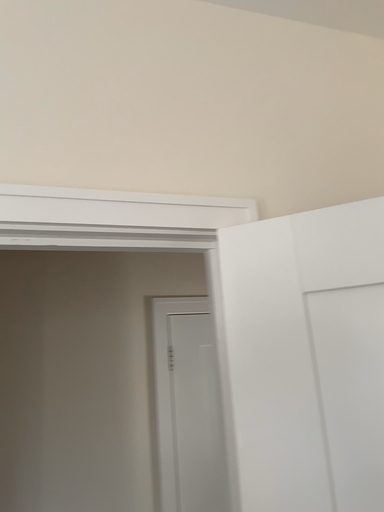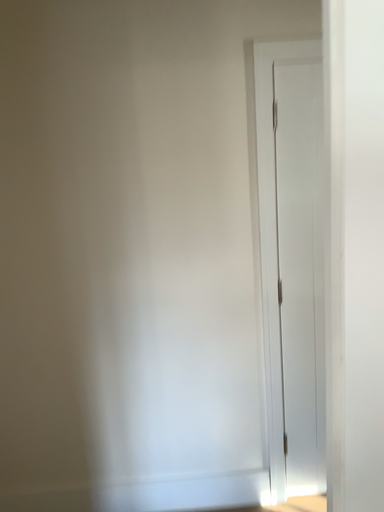
Question: Which way did the camera rotate in the video?

Choices:
 (A) rotated upward
 (B) rotated downward

Answer: (B)